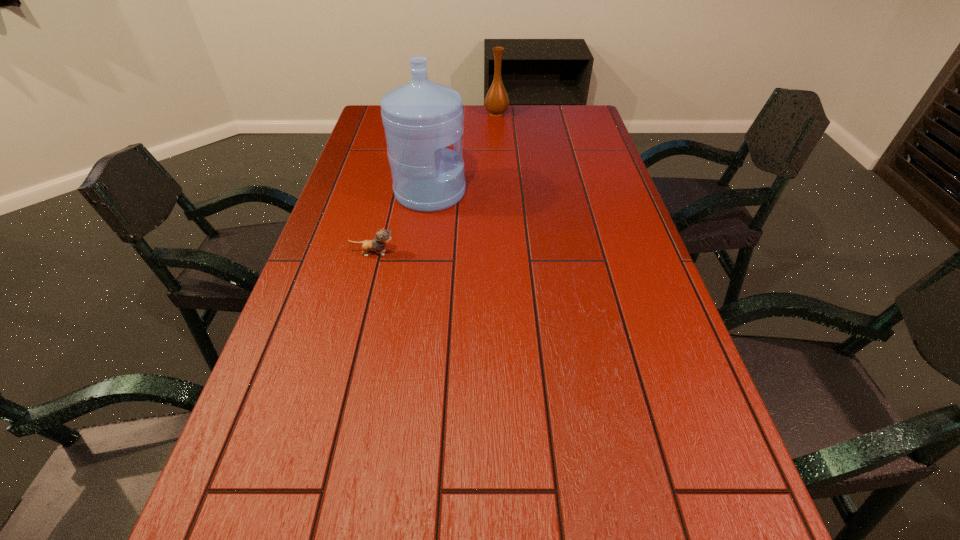
Locate an element on the screen. object that is at the left edge is located at coordinates (382, 236).

You are a GUI agent. You are given a task and a screenshot of the screen. Output one action in this format:
    pyautogui.click(x=<x>, y=<y>)
    Task: Click on the free space at the far edge
    Image resolution: width=960 pixels, height=540 pixels.
    Given the screenshot: What is the action you would take?
    pyautogui.click(x=469, y=124)

Where is `vacant space at the left edge of the desktop`? Image resolution: width=960 pixels, height=540 pixels. vacant space at the left edge of the desktop is located at coordinates (235, 517).

In the image, there is a desktop. In order to click on blank space at the right edge in this screenshot , I will do `click(720, 525)`.

Identify the location of free space at the far right corner. (589, 107).

What are the coordinates of `object that ranks as the second closest to the second tallest object` in the screenshot? It's located at (382, 236).

Where is `object that is the closest to the shortest object`? This screenshot has width=960, height=540. object that is the closest to the shortest object is located at coordinates (421, 118).